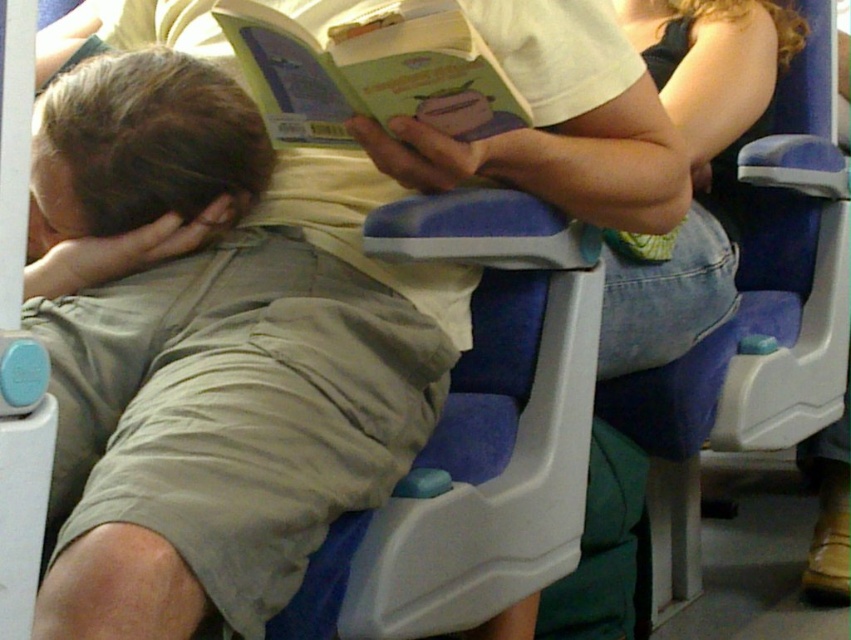
Question: Is brown matte hair at center wider than green matte book at upper center?

Choices:
 (A) no
 (B) yes

Answer: (A)

Question: Is brown matte hair at center to the right of green matte book at upper center from the viewer's perspective?

Choices:
 (A) yes
 (B) no

Answer: (B)

Question: Can you confirm if brown matte hair at center is bigger than green matte book at upper center?

Choices:
 (A) yes
 (B) no

Answer: (B)

Question: Which point is closer to the camera?

Choices:
 (A) brown matte hair at center
 (B) green matte book at upper center

Answer: (B)

Question: Which point appears closest to the camera in this image?

Choices:
 (A) (47, 112)
 (B) (238, 12)

Answer: (B)

Question: Which point is closer to the camera taking this photo?

Choices:
 (A) (515, 99)
 (B) (66, 97)

Answer: (A)